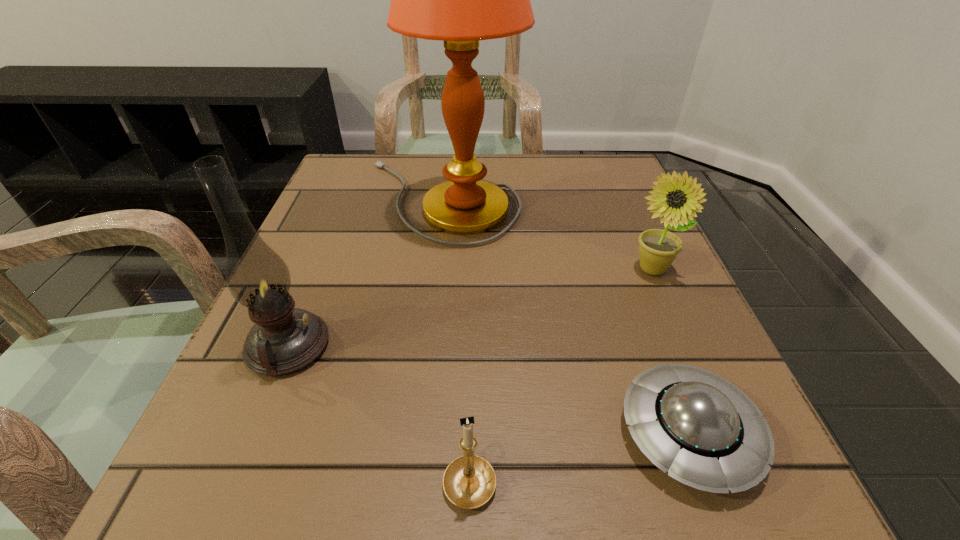
I want to click on the fourth closest object to the second shortest object, so click(x=460, y=0).

Choose which object is the nearest neighbor to the sunflower. Please provide its 2D coordinates. Your answer should be formatted as a tuple, i.e. [(x, y)], where the tuple contains the x and y coordinates of a point satisfying the conditions above.

[(460, 0)]